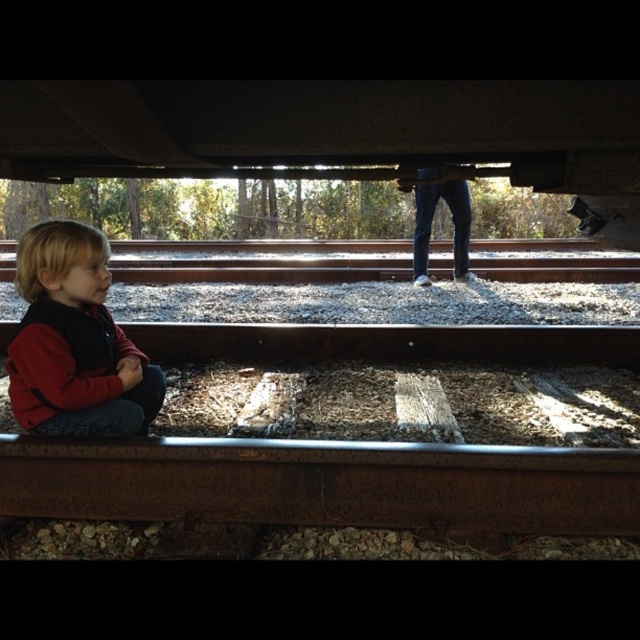
You are standing at the point labeled as point [352,444]. What object are you standing on?

You are standing on the rusty metal train track at lower center.

You are a pedestrian trying to cross the railway tracks safely. You see the rusty metal train track at lower center and the red fleece jacket at lower left. Which object is closer to the left side of the tracks?

The red fleece jacket at lower left is closer to the left side of the tracks because the rusty metal train track at lower center is positioned on its right side.

You are a photographer trying to capture both the rusty metal train track at lower center and the red fleece jacket at lower left in a single frame. Based on their sizes, which object should you focus on first to ensure both are in the frame?

The rusty metal train track at lower center is bigger than the red fleece jacket at lower left, so you should focus on the rusty metal train track at lower center first to ensure both are in the frame.